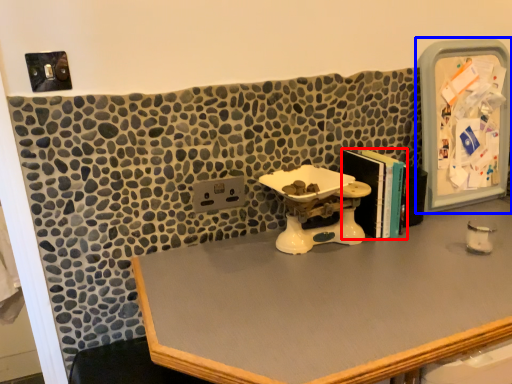
Question: Which point is closer to the camera, book (highlighted by a red box) or medicine cabinet (highlighted by a blue box)?

Choices:
 (A) book
 (B) medicine cabinet

Answer: (A)